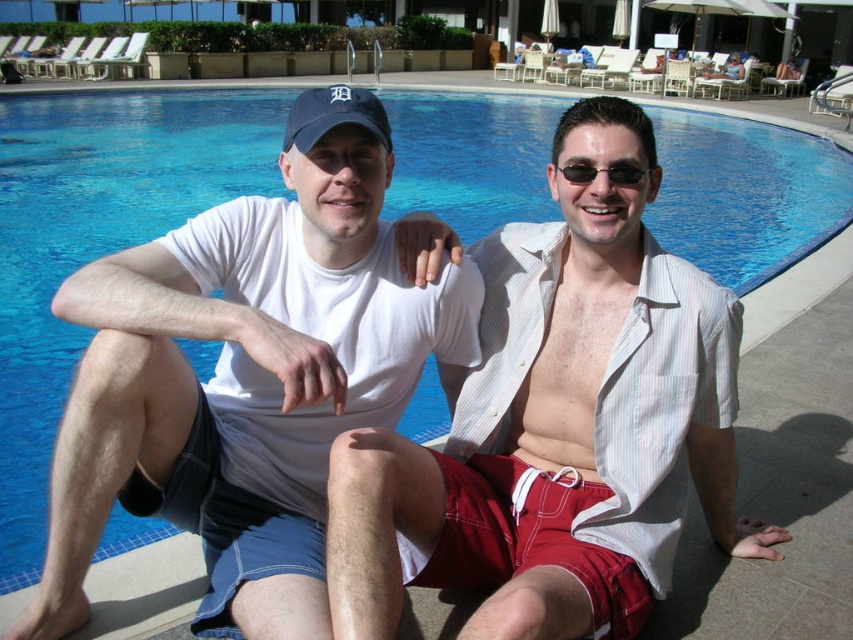
Question: Is white cotton shirt at center bigger than white cotton t-shirt at center?

Choices:
 (A) no
 (B) yes

Answer: (B)

Question: Which of the following is the farthest from the observer?

Choices:
 (A) white cotton t-shirt at center
 (B) sunglasses at center
 (C) white cotton shirt at center

Answer: (B)

Question: Considering the real-world distances, which object is closest to the white cotton shirt at center?

Choices:
 (A) white cotton t-shirt at center
 (B) sunglasses at center

Answer: (A)

Question: Is white cotton shirt at center positioned in front of white cotton t-shirt at center?

Choices:
 (A) yes
 (B) no

Answer: (A)

Question: Is white cotton shirt at center to the right of white cotton t-shirt at center from the viewer's perspective?

Choices:
 (A) yes
 (B) no

Answer: (A)

Question: Which point is farther to the camera?

Choices:
 (A) white cotton shirt at center
 (B) white cotton t-shirt at center

Answer: (B)